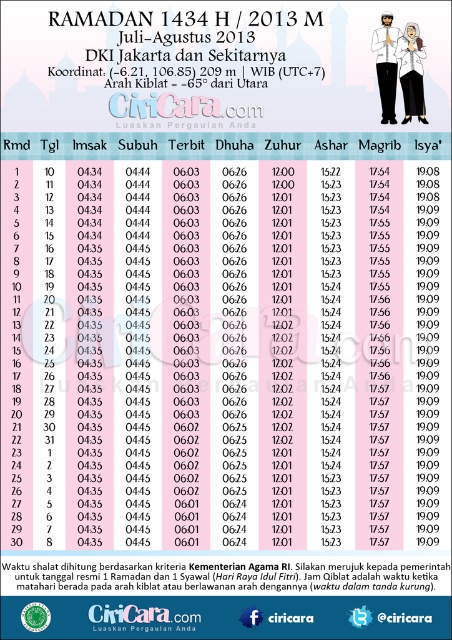
Question: Is white cotton shirt at upper right behind matte white shirt at center?

Choices:
 (A) yes
 (B) no

Answer: (A)

Question: Which point appears farthest from the camera in this image?

Choices:
 (A) (x=396, y=33)
 (B) (x=403, y=52)

Answer: (B)

Question: Which of the following is the farthest from the observer?

Choices:
 (A) (401, 74)
 (B) (390, 106)

Answer: (B)

Question: In this image, where is white cotton shirt at upper right located relative to matte white shirt at center?

Choices:
 (A) right
 (B) left

Answer: (A)

Question: Is white cotton shirt at upper right below matte white shirt at center?

Choices:
 (A) no
 (B) yes

Answer: (B)

Question: Which of the following is the farthest from the observer?

Choices:
 (A) (391, 64)
 (B) (414, 33)

Answer: (A)